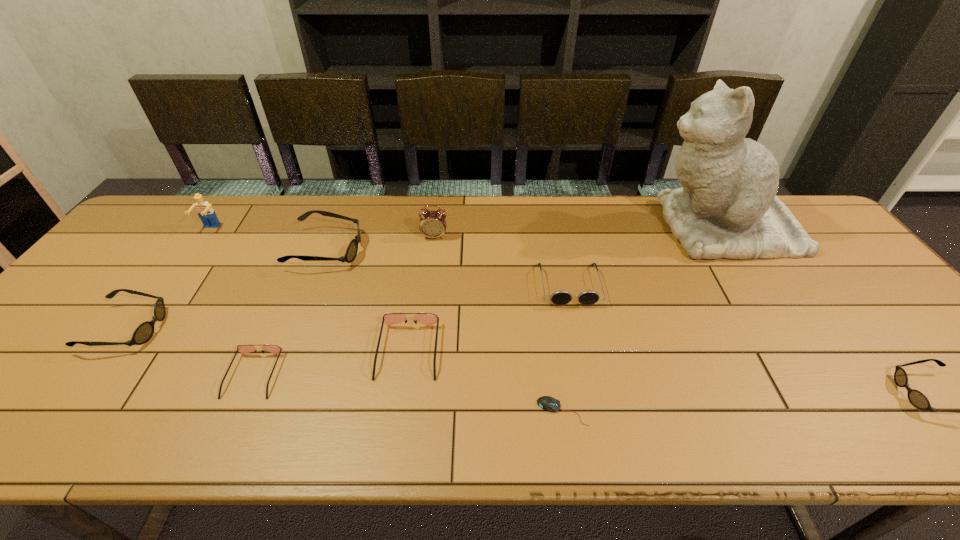
At what (x,y) coordinates should I click in order to perform the action: click on the left pink sunglasses. Please return your answer as a coordinate pair (x, y). The width and height of the screenshot is (960, 540). Looking at the image, I should click on (274, 349).

Find the location of a particular element. This screenshot has height=540, width=960. the shortest object is located at coordinates (548, 403).

Where is `black mouse`? This screenshot has width=960, height=540. black mouse is located at coordinates (548, 403).

This screenshot has width=960, height=540. In order to click on vacant space located 0.270m on the front-facing side of the tallest object in this screenshot , I will do `click(561, 227)`.

In order to click on vacant point located on the front-facing side of the tallest object in this screenshot , I will do `click(586, 227)`.

This screenshot has height=540, width=960. Identify the location of vacant area situated 0.310m on the front-facing side of the tallest object. (547, 227).

Identify the location of free space located 0.330m on the face of the blue Lego. (147, 317).

Find the location of a particular element. The image size is (960, 540). vacant region located on the face of the alarm clock is located at coordinates (422, 338).

You are a GUI agent. You are given a task and a screenshot of the screen. Output one action in this format:
    pyautogui.click(x=<x>, y=<y>)
    Task: Click on the free space located on the lenses of the tallest sunglasses
    
    Given the screenshot: What is the action you would take?
    (423, 249)

This screenshot has width=960, height=540. In order to click on free spot located on the front-facing side of the second sunglasses from right to left in this screenshot , I will do `click(583, 355)`.